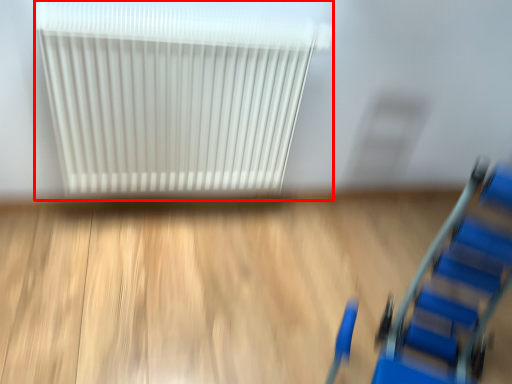
Question: From the image's perspective, what is the correct spatial relationship of radiator (annotated by the red box) in relation to furniture?

Choices:
 (A) above
 (B) below

Answer: (A)